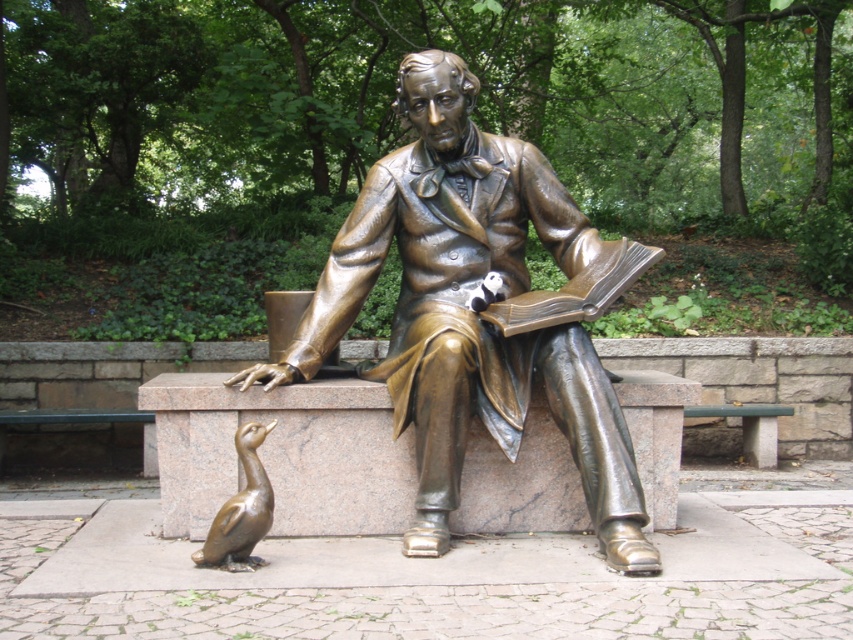
Question: From the image, what is the correct spatial relationship of bronze statue at center in relation to shiny bronze duckling at lower left?

Choices:
 (A) right
 (B) left

Answer: (A)

Question: Can you confirm if bronze statue at center is wider than shiny bronze duckling at lower left?

Choices:
 (A) no
 (B) yes

Answer: (B)

Question: Among these objects, which one is nearest to the camera?

Choices:
 (A) shiny bronze duckling at lower left
 (B) bronze statue at center

Answer: (A)

Question: From the image, what is the correct spatial relationship of bronze statue at center in relation to shiny bronze duckling at lower left?

Choices:
 (A) right
 (B) left

Answer: (A)

Question: Among these objects, which one is farthest from the camera?

Choices:
 (A) shiny bronze duckling at lower left
 (B) bronze statue at center

Answer: (B)